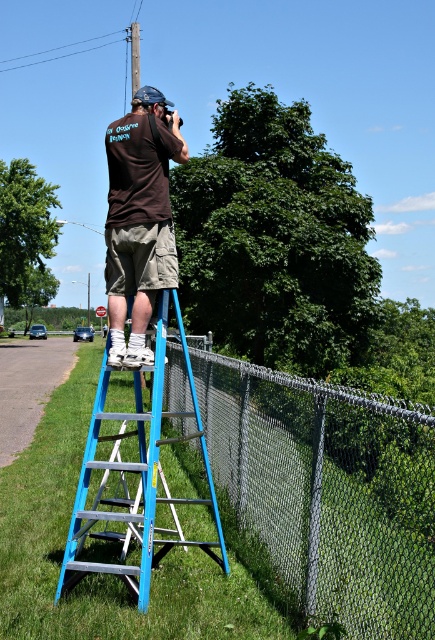
Question: Is brown cotton shirt at center thinner than brushed metal power line at upper center?

Choices:
 (A) yes
 (B) no

Answer: (A)

Question: Among these objects, which one is nearest to the camera?

Choices:
 (A) brushed metal telegraph pole at upper center
 (B) blue aluminum ladder at center
 (C) brushed metal power line at upper center

Answer: (B)

Question: Is blue aluminum ladder at center closer to the viewer compared to brown cotton shirt at center?

Choices:
 (A) no
 (B) yes

Answer: (B)

Question: Can you confirm if blue aluminum ladder at center is thinner than brushed metal telegraph pole at upper center?

Choices:
 (A) no
 (B) yes

Answer: (B)

Question: Among these objects, which one is farthest from the camera?

Choices:
 (A) brushed metal power line at upper center
 (B) brown cotton shirt at center
 (C) blue aluminum ladder at center

Answer: (A)

Question: Which object appears farthest from the camera in this image?

Choices:
 (A) brown cotton shirt at center
 (B) brushed metal power line at upper center

Answer: (B)